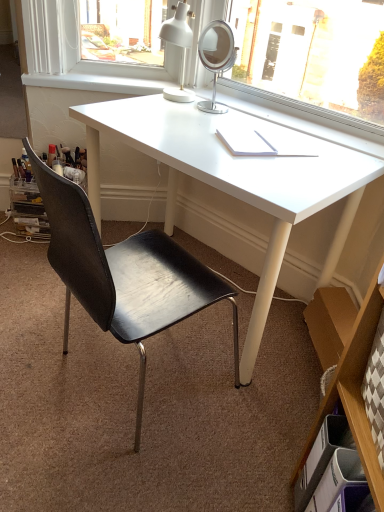
Find the location of a particular element. free spot to the right of black leather chair at center is located at coordinates (248, 426).